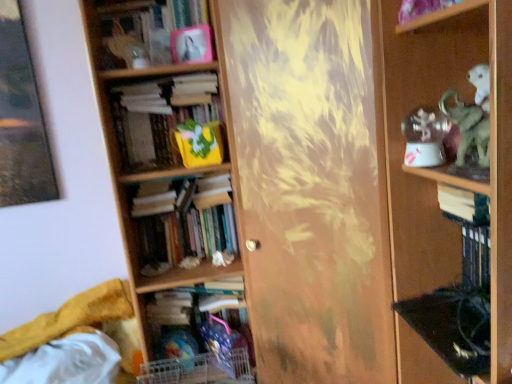
You are a GUI agent. You are given a task and a screenshot of the screen. Output one action in this format:
    pyautogui.click(x=<x>, y=<y>)
    Task: Click on the white paper book at right, marked as the third book in a bottom-to-top arrangement
    Image resolution: width=512 pixels, height=384 pixels.
    Given the screenshot: What is the action you would take?
    pyautogui.click(x=463, y=205)

What do you see at coordinates (185, 224) in the screenshot?
I see `hardcover books at center, which appears as the 2th book when ordered from the bottom` at bounding box center [185, 224].

In order to click on white paper book at right, marked as the third book in a bottom-to-top arrangement in this screenshot , I will do `click(463, 205)`.

Considering the positions of objects yellow fabric bag at center-left, which appears as the second book when viewed from the top, and translucent plastic toy at lower center in the image provided, who is in front, yellow fabric bag at center-left, which appears as the second book when viewed from the top, or translucent plastic toy at lower center?

Positioned in front is yellow fabric bag at center-left, which appears as the second book when viewed from the top.

Choose the correct answer: Is yellow fabric bag at center-left, which appears as the second book when viewed from the top, inside translucent plastic toy at lower center or outside it?

yellow fabric bag at center-left, which appears as the second book when viewed from the top, is located beyond the bounds of translucent plastic toy at lower center.

Is yellow fabric bag at center-left, which appears as the second book when viewed from the top, directly adjacent to translucent plastic toy at lower center?

yellow fabric bag at center-left, which appears as the second book when viewed from the top, is not next to translucent plastic toy at lower center, and they're not touching.

Is yellow fabric bag at center-left, which appears as the second book when viewed from the top, taller than translucent plastic toy at lower center?

Yes.

Is wooden shelf at right far away from hardcover books at center, which is the fourth book from top to bottom?

No, wooden shelf at right is in close proximity to hardcover books at center, which is the fourth book from top to bottom.

Which object is thinner, wooden shelf at right or hardcover books at center, which appears as the 2th book when ordered from the bottom?

Thinner between the two is hardcover books at center, which appears as the 2th book when ordered from the bottom.

Based on the photo, from the image's perspective, is wooden shelf at right above hardcover books at center, which is the fourth book from top to bottom?

Yes, from the image's perspective, wooden shelf at right is over hardcover books at center, which is the fourth book from top to bottom.

Considering their positions, is wooden shelf at right located in front of or behind hardcover books at center, which appears as the 2th book when ordered from the bottom?

Clearly, wooden shelf at right is in front of hardcover books at center, which appears as the 2th book when ordered from the bottom.

Which object is thinner, yellow fabric bag at center-left, which ranks as the 4th book in bottom-to-top order, or hardcover book at lower center, the 1th book in the bottom-to-top sequence?

Thinner between the two is yellow fabric bag at center-left, which ranks as the 4th book in bottom-to-top order.

Considering the relative positions of yellow fabric bag at center-left, which ranks as the 4th book in bottom-to-top order, and hardcover book at lower center, placed as the fifth book when sorted from top to bottom, in the image provided, is yellow fabric bag at center-left, which ranks as the 4th book in bottom-to-top order, to the left or to the right of hardcover book at lower center, placed as the fifth book when sorted from top to bottom,?

yellow fabric bag at center-left, which ranks as the 4th book in bottom-to-top order, is to the left of hardcover book at lower center, placed as the fifth book when sorted from top to bottom.

The image size is (512, 384). Find the location of `book that is the 3rd object above the hardcover book at lower center, the 1th book in the bottom-to-top sequence (from a real-world perspective)`. book that is the 3rd object above the hardcover book at lower center, the 1th book in the bottom-to-top sequence (from a real-world perspective) is located at coordinates (168, 121).

From the image's perspective, is yellow fabric bag at center-left, which appears as the second book when viewed from the top, above hardcover book at lower center, placed as the fifth book when sorted from top to bottom?

Yes, from the image's perspective, yellow fabric bag at center-left, which appears as the second book when viewed from the top, is on top of hardcover book at lower center, placed as the fifth book when sorted from top to bottom.

Is white paper book at right, placed as the 3th book when sorted from top to bottom, located within translucent plastic toy at lower center?

That's incorrect, white paper book at right, placed as the 3th book when sorted from top to bottom, is not inside translucent plastic toy at lower center.

Is white paper book at right, placed as the 3th book when sorted from top to bottom, at the back of translucent plastic toy at lower center?

That's not correct — translucent plastic toy at lower center is not looking away from white paper book at right, placed as the 3th book when sorted from top to bottom.

Is translucent plastic toy at lower center next to white paper book at right, marked as the third book in a bottom-to-top arrangement, and touching it?

translucent plastic toy at lower center and white paper book at right, marked as the third book in a bottom-to-top arrangement, are not in contact.

Is white paper book at right, marked as the third book in a bottom-to-top arrangement, situated inside matte pink photo frame at upper center, which is the 5th book from bottom to top, or outside?

The correct answer is: outside.

Considering the relative sizes of white paper book at right, marked as the third book in a bottom-to-top arrangement, and matte pink photo frame at upper center, which is the 5th book from bottom to top, in the image provided, is white paper book at right, marked as the third book in a bottom-to-top arrangement, shorter than matte pink photo frame at upper center, which is the 5th book from bottom to top,?

Indeed, white paper book at right, marked as the third book in a bottom-to-top arrangement, has a lesser height compared to matte pink photo frame at upper center, which is the 5th book from bottom to top.

Is white paper book at right, marked as the third book in a bottom-to-top arrangement, beside matte pink photo frame at upper center, marked as the 1th book in a top-to-bottom arrangement?

They are not placed beside each other.

Does wooden bookcase at left have a smaller size compared to wooden shelf at right?

No.

Is wooden bookcase at left beside wooden shelf at right?

No, wooden bookcase at left is not in contact with wooden shelf at right.

From the image's perspective, between wooden bookcase at left and wooden shelf at right, which one is located above?

wooden shelf at right is shown above in the image.

In the scene shown: From a real-world perspective, is wooden bookcase at left located higher than wooden shelf at right?

Incorrect, from a real-world perspective, wooden bookcase at left is lower than wooden shelf at right.

Is yellow fabric bag at center-left, which ranks as the 4th book in bottom-to-top order, inside the boundaries of hardcover books at center, which is the fourth book from top to bottom, or outside?

yellow fabric bag at center-left, which ranks as the 4th book in bottom-to-top order, lies outside hardcover books at center, which is the fourth book from top to bottom.

Based on the photo, between yellow fabric bag at center-left, which appears as the second book when viewed from the top, and hardcover books at center, which is the fourth book from top to bottom, which one appears on the right side from the viewer's perspective?

hardcover books at center, which is the fourth book from top to bottom, is more to the right.

Does yellow fabric bag at center-left, which appears as the second book when viewed from the top, have a greater height compared to hardcover books at center, which is the fourth book from top to bottom?

No, yellow fabric bag at center-left, which appears as the second book when viewed from the top, is not taller than hardcover books at center, which is the fourth book from top to bottom.

From the image's perspective, which is above, yellow fabric bag at center-left, which ranks as the 4th book in bottom-to-top order, or hardcover books at center, which is the fourth book from top to bottom?

yellow fabric bag at center-left, which ranks as the 4th book in bottom-to-top order.

Image resolution: width=512 pixels, height=384 pixels. I want to click on toy on the right of yellow fabric bag at center-left, which ranks as the 4th book in bottom-to-top order, so click(x=178, y=348).

From a real-world perspective, count 1st books downward from the wooden shelf at right and point to it. Please provide its 2D coordinates.

[(185, 224)]

Which object lies nearer to the anchor point wooden shelf at right, translucent plastic toy at lower center or yellow fabric bag at center-left, which appears as the second book when viewed from the top?

yellow fabric bag at center-left, which appears as the second book when viewed from the top, is positioned closer to the anchor wooden shelf at right.

Estimate the real-world distances between objects in this image. Which object is further from yellow fabric bag at center-left, which ranks as the 4th book in bottom-to-top order, hardcover books at center, which is the fourth book from top to bottom, or white paper book at right, marked as the third book in a bottom-to-top arrangement?

white paper book at right, marked as the third book in a bottom-to-top arrangement, is further to yellow fabric bag at center-left, which ranks as the 4th book in bottom-to-top order.

Based on their spatial positions, is translucent plastic toy at lower center or white paper book at right, placed as the 3th book when sorted from top to bottom, further from yellow fabric bag at center-left, which ranks as the 4th book in bottom-to-top order?

white paper book at right, placed as the 3th book when sorted from top to bottom, lies further to yellow fabric bag at center-left, which ranks as the 4th book in bottom-to-top order, than the other object.

Consider the image. When comparing their distances from hardcover book at lower center, the 1th book in the bottom-to-top sequence, does yellow fabric bag at center-left, which appears as the second book when viewed from the top, or wooden shelf at right seem closer?

yellow fabric bag at center-left, which appears as the second book when viewed from the top, is positioned closer to the anchor hardcover book at lower center, the 1th book in the bottom-to-top sequence.

Which object lies further to the anchor point matte pink photo frame at upper center, marked as the 1th book in a top-to-bottom arrangement, white paper book at right, placed as the 3th book when sorted from top to bottom, or hardcover book at lower center, placed as the fifth book when sorted from top to bottom?

The object further to matte pink photo frame at upper center, marked as the 1th book in a top-to-bottom arrangement, is hardcover book at lower center, placed as the fifth book when sorted from top to bottom.

Which object lies further to the anchor point wooden bookcase at left, translucent plastic toy at lower center or matte pink photo frame at upper center, marked as the 1th book in a top-to-bottom arrangement?

The object further to wooden bookcase at left is translucent plastic toy at lower center.

Considering their positions, is white paper book at right, marked as the third book in a bottom-to-top arrangement, positioned closer to wooden shelf at right than hardcover books at center, which appears as the 2th book when ordered from the bottom?

white paper book at right, marked as the third book in a bottom-to-top arrangement, is closer to wooden shelf at right.

Looking at the image, which one is located closer to white paper book at right, marked as the third book in a bottom-to-top arrangement, wooden bookcase at left or wooden shelf at right?

wooden shelf at right is closer to white paper book at right, marked as the third book in a bottom-to-top arrangement.

Locate an element on the screen. Image resolution: width=512 pixels, height=384 pixels. shelf between matte pink photo frame at upper center, marked as the 1th book in a top-to-bottom arrangement, and translucent plastic toy at lower center vertically is located at coordinates (445, 167).

The image size is (512, 384). I want to click on toy between yellow fabric bag at center-left, which ranks as the 4th book in bottom-to-top order, and white paper book at right, placed as the 3th book when sorted from top to bottom, in the horizontal direction, so click(178, 348).

The width and height of the screenshot is (512, 384). Find the location of `bookcase between yellow fabric bag at center-left, which appears as the second book when viewed from the top, and wooden shelf at right, in the horizontal direction`. bookcase between yellow fabric bag at center-left, which appears as the second book when viewed from the top, and wooden shelf at right, in the horizontal direction is located at coordinates (164, 166).

Where is `shelf between matte pink photo frame at upper center, marked as the 1th book in a top-to-bottom arrangement, and hardcover book at lower center, placed as the fifth book when sorted from top to bottom, in the up-down direction`? The width and height of the screenshot is (512, 384). shelf between matte pink photo frame at upper center, marked as the 1th book in a top-to-bottom arrangement, and hardcover book at lower center, placed as the fifth book when sorted from top to bottom, in the up-down direction is located at coordinates (445, 167).